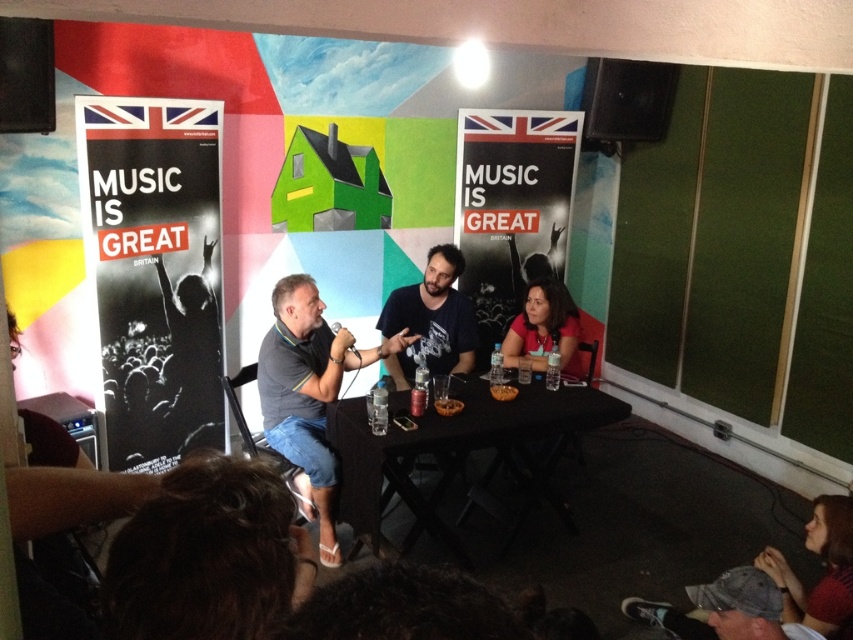
What are the coordinates of the gray fabric shirt at center in the image?

The gray fabric shirt at center is located at coordinates point (x=309, y=388).

You are a photographer at the event and need to capture a clear shot of both the gray fabric shirt at center and the translucent plastic cup at center. Since you want both to be visible, would the cup be fully visible without being blocked by the shirt?

The gray fabric shirt at center has a greater height compared to the translucent plastic cup at center. Therefore, the cup might be partially blocked by the shirt if positioned directly behind it, so adjust the angle to ensure visibility.

You are organizing a music event and need to ensure visibility of promotional materials. Given the scene, which object between the black paper poster at center and the gray fabric shirt at center is more suitable for displaying event information?

The black paper poster at center is more suitable for displaying event information because it has a larger size compared to the gray fabric shirt at center, making it more visible to attendees.